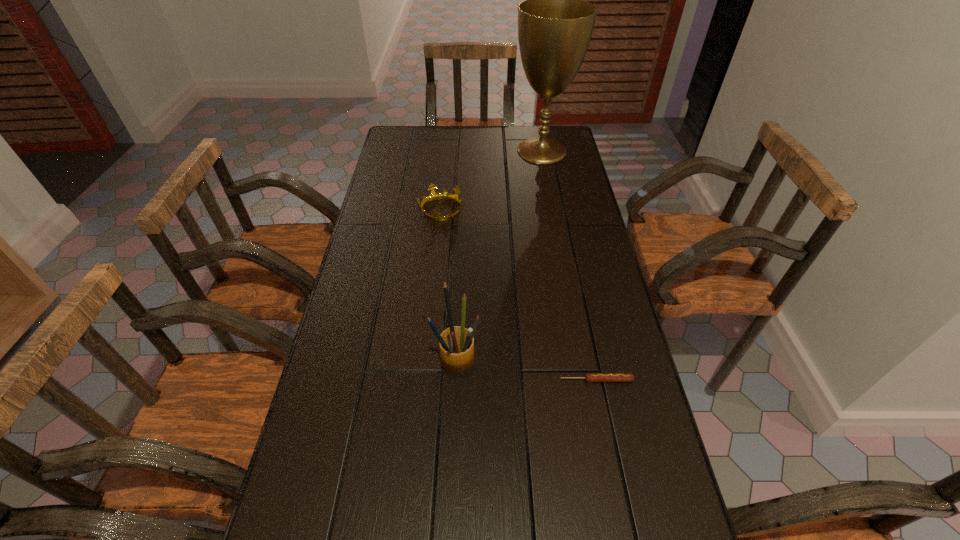
You are a GUI agent. You are given a task and a screenshot of the screen. Output one action in this format:
    pyautogui.click(x=<x>, y=<y>)
    Task: Click on the free space that is in between the tallest object and the third shortest object
    This screenshot has width=960, height=540.
    Given the screenshot: What is the action you would take?
    pyautogui.click(x=499, y=255)

Where is `free space between the pencil box and the crown`? free space between the pencil box and the crown is located at coordinates (448, 285).

The width and height of the screenshot is (960, 540). Find the location of `vacant point located between the second farthest object and the farthest object`. vacant point located between the second farthest object and the farthest object is located at coordinates (492, 180).

Locate an element on the screen. The height and width of the screenshot is (540, 960). empty location between the crown and the sausage is located at coordinates (518, 295).

This screenshot has height=540, width=960. Find the location of `object identified as the third closest to the pencil box`. object identified as the third closest to the pencil box is located at coordinates (555, 24).

Where is `object that stands as the third closest to the sausage`? object that stands as the third closest to the sausage is located at coordinates point(555,24).

At what (x,y) coordinates should I click in order to perform the action: click on vacant area that satisfies the following two spatial constraints: 1. on the front side of the tallest object; 2. on the right side of the shortest object. Please return your answer as a coordinate pair (x, y). This screenshot has height=540, width=960. Looking at the image, I should click on (585, 380).

Find the location of a particular element. vacant space that satisfies the following two spatial constraints: 1. on the back side of the third tallest object; 2. on the left side of the tallest object is located at coordinates (446, 151).